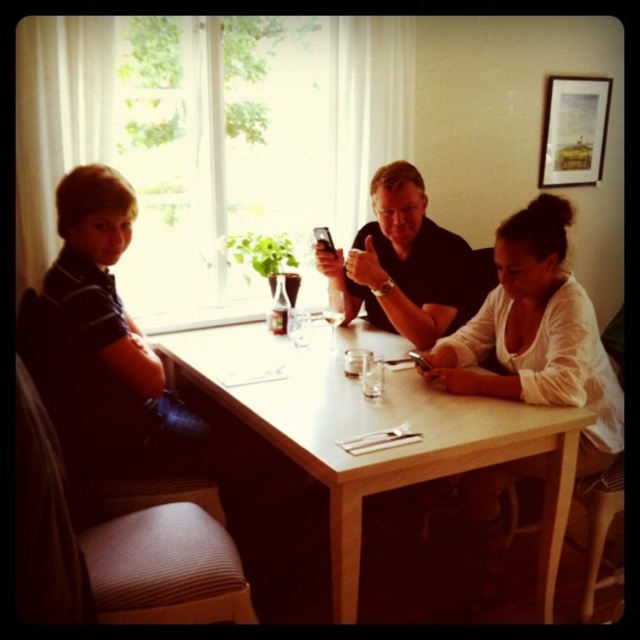
Is light wood table at center thinner than matte black shirt at center?

No.

Is point (272, 380) closer to camera compared to point (353, 307)?

Yes, it is.

Image resolution: width=640 pixels, height=640 pixels. I want to click on light wood table at center, so coord(376,429).

Is the position of light wood table at center more distant than that of white matte shirt at center?

No, it is in front of white matte shirt at center.

Is point (499, 419) closer to viewer compared to point (492, 589)?

Yes.

Which is behind, point (332, 477) or point (570, 211)?

The point (570, 211) is behind.

Find the location of a particular element. The image size is (640, 640). light wood table at center is located at coordinates (376, 429).

Does white matte shirt at center come in front of matte black shirt at center?

Yes.

Does white matte shirt at center have a lesser height compared to matte black shirt at center?

No, white matte shirt at center is not shorter than matte black shirt at center.

Locate an element on the screen. white matte shirt at center is located at coordinates (536, 333).